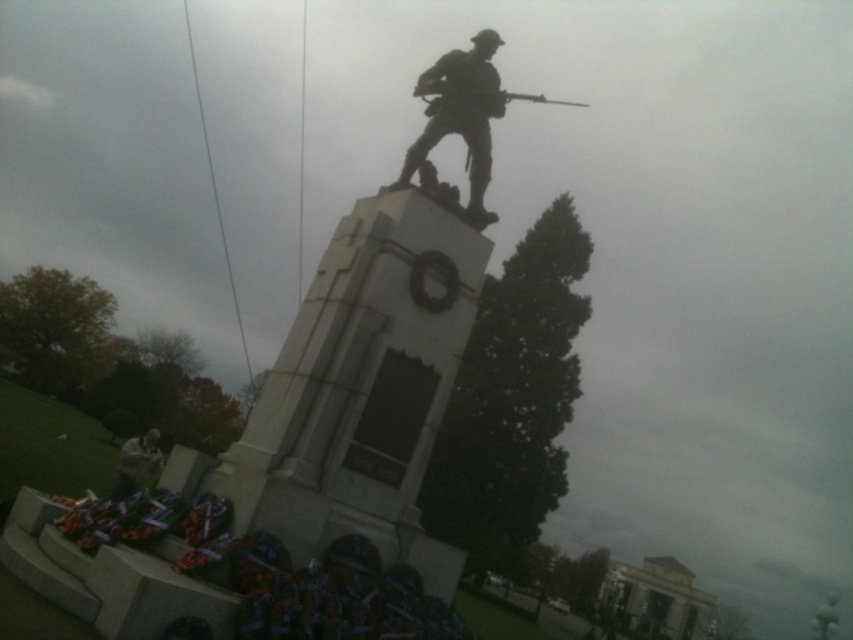
Measure the distance between metallic silver helmet at lower left and shiny metallic rifle at upper center.

A distance of 20.74 meters exists between metallic silver helmet at lower left and shiny metallic rifle at upper center.

Which of these two, metallic silver helmet at lower left or shiny metallic rifle at upper center, stands taller?

shiny metallic rifle at upper center is taller.

Does point (148, 429) lie in front of point (498, 93)?

No.

At what (x,y) coordinates should I click in order to perform the action: click on metallic silver helmet at lower left. Please return your answer as a coordinate pair (x, y). The width and height of the screenshot is (853, 640). Looking at the image, I should click on (136, 464).

Is polished bronze soldier at center smaller than shiny metallic rifle at upper center?

Yes.

Does point (450, 67) come closer to viewer compared to point (486, 90)?

No.

At what (x,y) coordinates should I click in order to perform the action: click on polished bronze soldier at center. Please return your answer as a coordinate pair (x, y). Looking at the image, I should click on (460, 116).

Is polished bronze soldier at center below metallic silver helmet at lower left?

No.

Which is behind, point (463, 92) or point (126, 464)?

Point (126, 464)

Locate an element on the screen. This screenshot has height=640, width=853. polished bronze soldier at center is located at coordinates (460, 116).